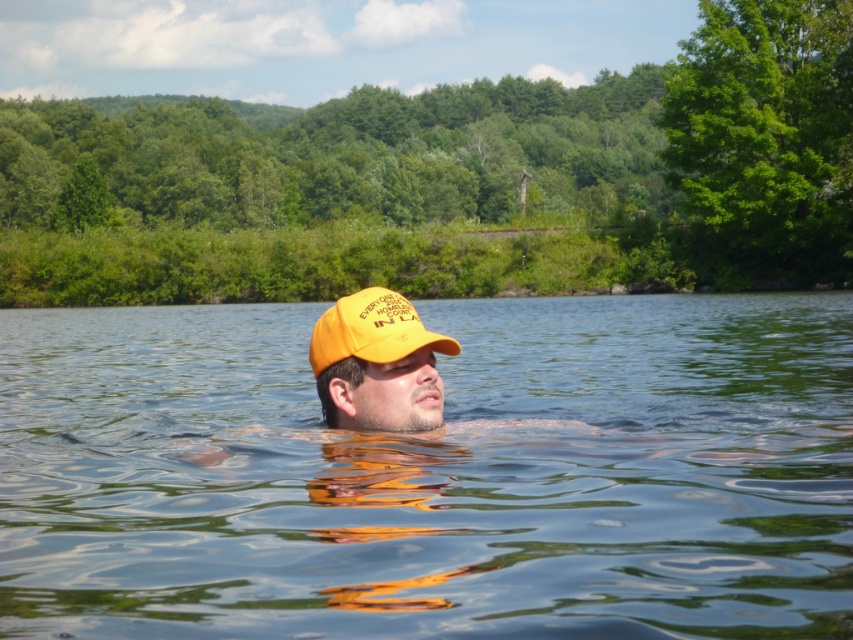
Is transparent water at center taller than yellow matte baseball cap at center?

Yes, transparent water at center is taller than yellow matte baseball cap at center.

Does transparent water at center have a smaller size compared to yellow matte baseball cap at center?

Incorrect, transparent water at center is not smaller in size than yellow matte baseball cap at center.

Describe the element at coordinates (432, 474) in the screenshot. This screenshot has width=853, height=640. I see `transparent water at center` at that location.

I want to click on transparent water at center, so click(x=432, y=474).